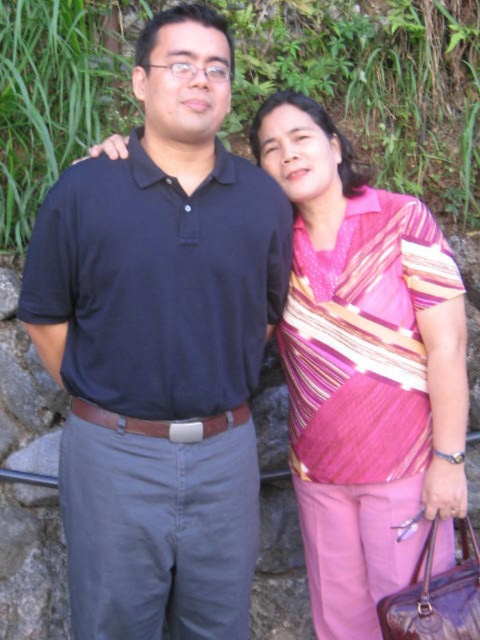
In the scene shown: Who is shorter, matte black shirt at center or pink striped blouse at center?

With less height is pink striped blouse at center.

Can you confirm if matte black shirt at center is taller than pink striped blouse at center?

Yes, matte black shirt at center is taller than pink striped blouse at center.

Between point (108, 232) and point (424, 417), which one is positioned behind?

Positioned behind is point (424, 417).

This screenshot has width=480, height=640. I want to click on matte black shirt at center, so click(x=160, y=348).